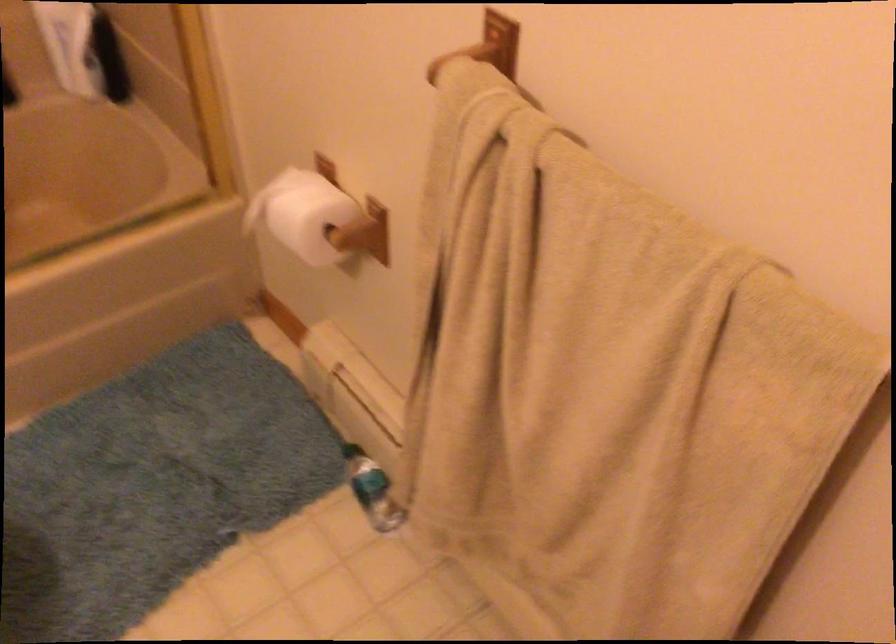
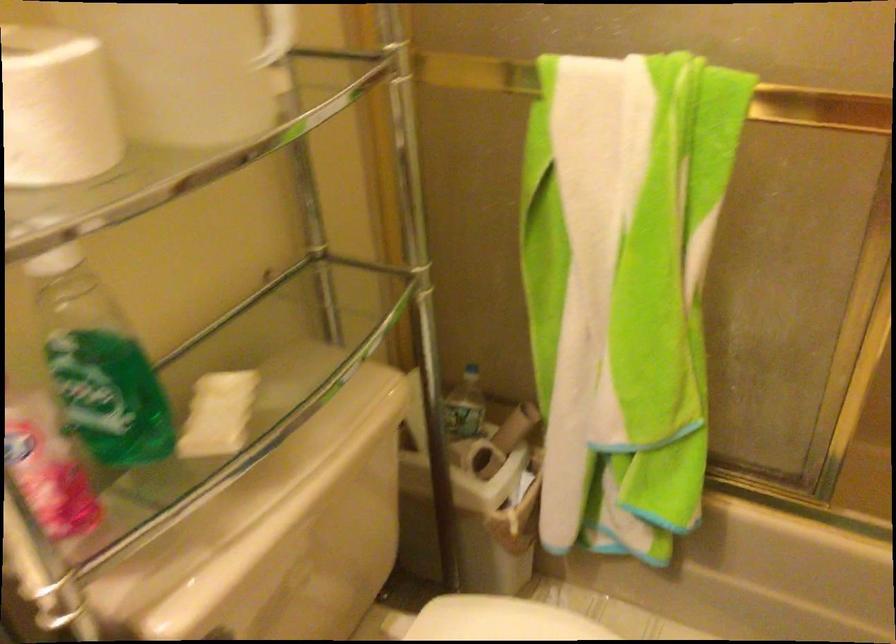
Question: The images are taken continuously from a first-person perspective. In which direction is your viewpoint rotating?

Choices:
 (A) Left
 (B) Right
 (C) Up
 (D) Down

Answer: (A)